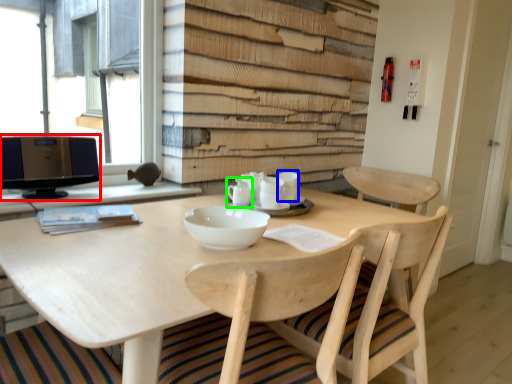
Question: Which object is the farthest from computer monitor (highlighted by a red box)? Choose among these: tableware (highlighted by a blue box) or tableware (highlighted by a green box).

Choices:
 (A) tableware
 (B) tableware

Answer: (A)